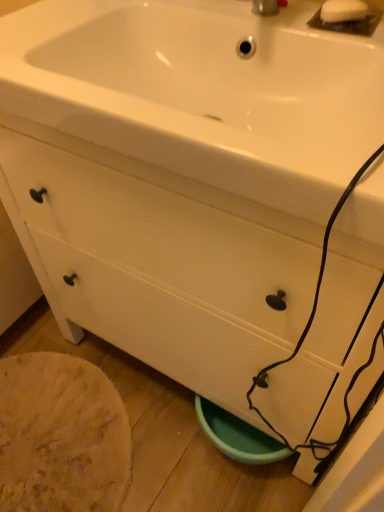
Find the location of a particular element. The image size is (384, 512). free spot to the left of white matte soap at upper right is located at coordinates (269, 18).